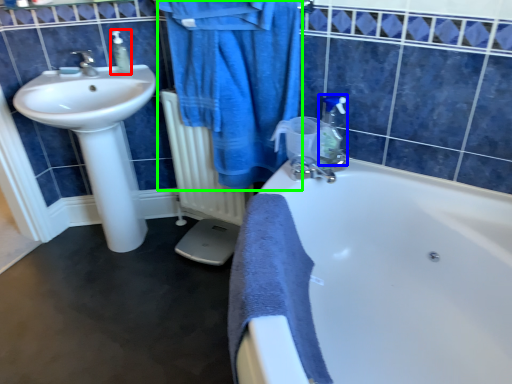
Question: Considering the real-world distances, which object is farthest from soap dispenser (highlighted by a red box)? soap dispenser (highlighted by a blue box) or bathrobe (highlighted by a green box)?

Choices:
 (A) soap dispenser
 (B) bathrobe

Answer: (A)